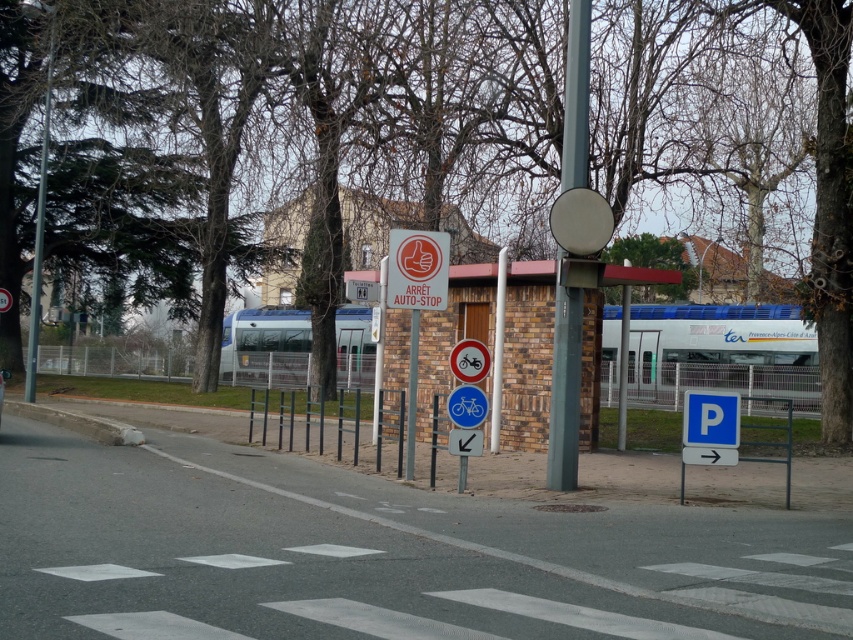
Question: Which object is the farthest from the brick wall bus stop at center?

Choices:
 (A) blue plastic bicycle at center
 (B) red plastic sign at center

Answer: (A)

Question: From the image, what is the correct spatial relationship of brick wall bus stop at center in relation to white plastic bicycle at center?

Choices:
 (A) right
 (B) left

Answer: (B)

Question: Is smooth gray pole at center thinner than blue plastic bicycle at center?

Choices:
 (A) no
 (B) yes

Answer: (B)

Question: In this image, where is brick wall bus stop at center located relative to red plastic sign at center?

Choices:
 (A) right
 (B) left

Answer: (B)

Question: Which of these objects is positioned farthest from the red plastic sign at center?

Choices:
 (A) blue plastic parking sign at lower right
 (B) white plastic bicycle at center
 (C) brick wall bus stop at center

Answer: (C)

Question: Which of the following is the closest to the observer?

Choices:
 (A) (582, 86)
 (B) (544, 266)
 (C) (457, 419)
 (D) (468, 374)

Answer: (C)